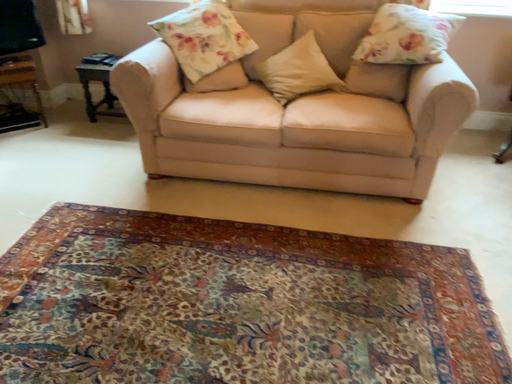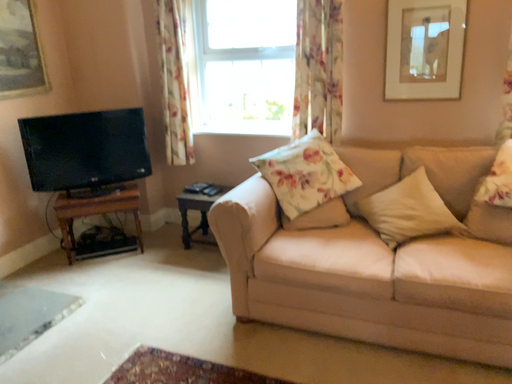
Question: How did the camera likely rotate when shooting the video?

Choices:
 (A) rotated upward
 (B) rotated downward

Answer: (A)